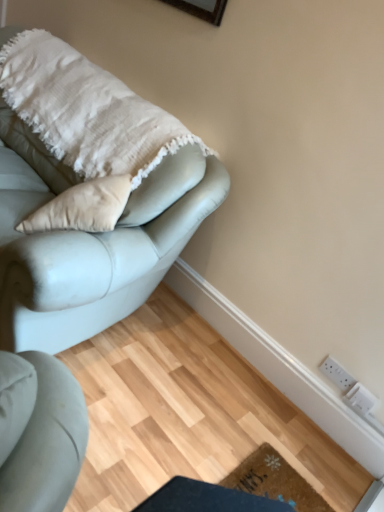
Question: Can you confirm if white plastic electric outlet at lower right, arranged as the 1th electric outlet when ordered from the bottom, is thinner than brown textured mat at lower center?

Choices:
 (A) yes
 (B) no

Answer: (A)

Question: Is white plastic electric outlet at lower right, placed as the 2th electric outlet when sorted from top to bottom, not near brown textured mat at lower center?

Choices:
 (A) no
 (B) yes

Answer: (A)

Question: Is white plastic electric outlet at lower right, arranged as the 1th electric outlet when ordered from the bottom, closer to the viewer compared to brown textured mat at lower center?

Choices:
 (A) no
 (B) yes

Answer: (A)

Question: Can you confirm if white plastic electric outlet at lower right, placed as the 2th electric outlet when sorted from top to bottom, is shorter than brown textured mat at lower center?

Choices:
 (A) yes
 (B) no

Answer: (B)

Question: From the image's perspective, is white plastic electric outlet at lower right, placed as the 2th electric outlet when sorted from top to bottom, below brown textured mat at lower center?

Choices:
 (A) yes
 (B) no

Answer: (B)

Question: Is white plastic electric outlet at lower right, arranged as the 1th electric outlet when ordered from the bottom, at the right side of brown textured mat at lower center?

Choices:
 (A) no
 (B) yes

Answer: (B)

Question: Is the position of satin light blue couch at upper left more distant than that of white textured blanket at upper left?

Choices:
 (A) no
 (B) yes

Answer: (A)

Question: Is satin light blue couch at upper left thinner than white textured blanket at upper left?

Choices:
 (A) yes
 (B) no

Answer: (B)

Question: From the image's perspective, does satin light blue couch at upper left appear lower than white textured blanket at upper left?

Choices:
 (A) no
 (B) yes

Answer: (B)

Question: From a real-world perspective, does satin light blue couch at upper left sit lower than white textured blanket at upper left?

Choices:
 (A) yes
 (B) no

Answer: (A)

Question: Is satin light blue couch at upper left in front of white textured blanket at upper left?

Choices:
 (A) no
 (B) yes

Answer: (B)

Question: Is satin light blue couch at upper left oriented towards white textured blanket at upper left?

Choices:
 (A) yes
 (B) no

Answer: (B)

Question: From the image's perspective, does brown textured mat at lower center appear higher than white plastic electric outlet at lower right, arranged as the 1th electric outlet when ordered from the bottom?

Choices:
 (A) no
 (B) yes

Answer: (A)